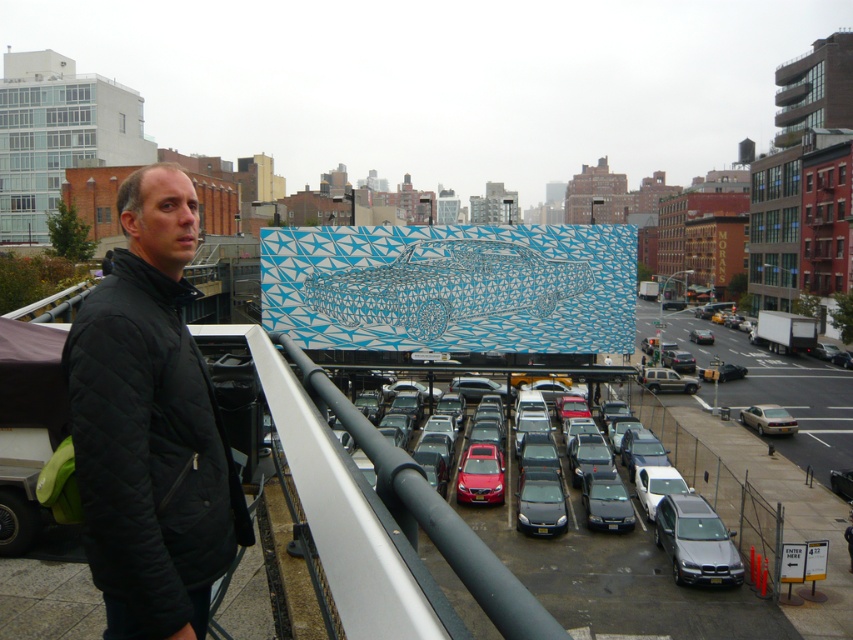
You are a delivery person trying to park your 1.8 meters wide truck between the satin silver sedan at lower right and the satin black sedan at center. Can you fit your truck there?

The satin silver sedan at lower right might be wider than satin black sedan at center, so the available space between them is uncertain. It is possible that the space is narrower than 1.8 meters, making it risky to attempt parking there.

You are standing on the pedestrian bridge and want to take a photo of the satin silver sedan at lower right. The camera you have can focus on objects up to 70 feet away. Will you be able to capture a clear photo of the sedan?

The satin silver sedan at lower right and camera are 73.51 feet apart, which is beyond the camera focus range of 70 feet. Therefore, you won not be able to capture a clear photo of the sedan.

You are standing at the camera position and want to reach point [454,332]. Is the distance more than 40 meters?

Yes, the distance between the camera and point [454,332] is 46.15 meters, which is more than 40 meters.